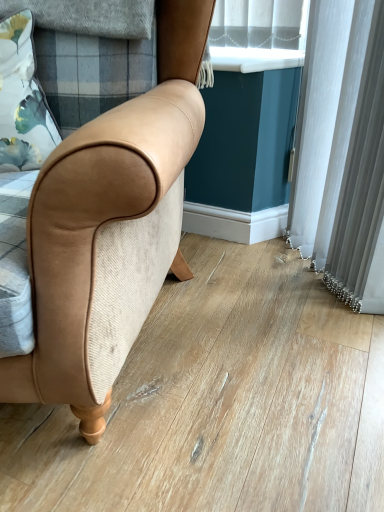
Locate an element on the screen. The image size is (384, 512). white plastic window sill at upper center is located at coordinates (254, 58).

The height and width of the screenshot is (512, 384). What are the coordinates of `floral fabric pillow at upper left` in the screenshot? It's located at (22, 99).

Considering the positions of objects floral fabric pillow at upper left and tan leather chair at center in the image provided, who is more to the left, floral fabric pillow at upper left or tan leather chair at center?

Positioned to the left is tan leather chair at center.

From the image's perspective, who appears lower, floral fabric pillow at upper left or tan leather chair at center?

tan leather chair at center is shown below in the image.

Is floral fabric pillow at upper left aimed at tan leather chair at center?

Yes.

From a real-world perspective, is floral fabric pillow at upper left located beneath tan leather chair at center?

Incorrect, from a real-world perspective, floral fabric pillow at upper left is higher than tan leather chair at center.

The width and height of the screenshot is (384, 512). In order to click on window sill that is behind the floral fabric pillow at upper left in this screenshot , I will do (x=254, y=58).

From the image's perspective, is floral fabric pillow at upper left on top of white plastic window sill at upper center?

No, from the image's perspective, floral fabric pillow at upper left is not above white plastic window sill at upper center.

Is floral fabric pillow at upper left bigger or smaller than white plastic window sill at upper center?

In the image, floral fabric pillow at upper left appears to be larger than white plastic window sill at upper center.

Is floral fabric pillow at upper left facing towards white plastic window sill at upper center?

No, floral fabric pillow at upper left does not turn towards white plastic window sill at upper center.

Does tan leather chair at center turn towards white plastic window sill at upper center?

No.

Based on the photo, is tan leather chair at center in contact with white plastic window sill at upper center?

tan leather chair at center is not next to white plastic window sill at upper center, and they're not touching.

Is tan leather chair at center further to the viewer compared to white plastic window sill at upper center?

No, it is not.

Can you confirm if tan leather chair at center is thinner than white plastic window sill at upper center?

No.

In the scene shown: Considering the relative sizes of tan leather chair at center and floral fabric pillow at upper left in the image provided, is tan leather chair at center thinner than floral fabric pillow at upper left?

No, tan leather chair at center is not thinner than floral fabric pillow at upper left.

Can you tell me how much tan leather chair at center and floral fabric pillow at upper left differ in facing direction?

tan leather chair at center and floral fabric pillow at upper left are facing 18.6 degrees away from each other.

From the image's perspective, which is above, tan leather chair at center or floral fabric pillow at upper left?

floral fabric pillow at upper left is shown above in the image.

Does tan leather chair at center touch floral fabric pillow at upper left?

There is a gap between tan leather chair at center and floral fabric pillow at upper left.

Does white plastic window sill at upper center have a lesser height compared to floral fabric pillow at upper left?

Correct, white plastic window sill at upper center is not as tall as floral fabric pillow at upper left.

Locate an element on the screen. pillow lying below the white plastic window sill at upper center (from the image's perspective) is located at coordinates (22, 99).

Does point (293, 57) come farther from viewer compared to point (22, 136)?

Yes, point (293, 57) is farther from viewer.

From a real-world perspective, is white plastic window sill at upper center physically located above or below floral fabric pillow at upper left?

white plastic window sill at upper center is situated higher than floral fabric pillow at upper left in the real world.

Is white plastic window sill at upper center spatially inside tan leather chair at center, or outside of it?

The correct answer is: outside.

From a real-world perspective, is white plastic window sill at upper center over tan leather chair at center?

Yes.

Between white plastic window sill at upper center and tan leather chair at center, which one has less height?

white plastic window sill at upper center.

At what (x,y) coordinates should I click in order to perform the action: click on chair below the floral fabric pillow at upper left (from a real-world perspective). Please return your answer as a coordinate pair (x, y). Image resolution: width=384 pixels, height=512 pixels. Looking at the image, I should click on (109, 228).

Image resolution: width=384 pixels, height=512 pixels. Identify the location of pillow on the left side of white plastic window sill at upper center. (22, 99).

Considering their positions, is tan leather chair at center positioned further to white plastic window sill at upper center than floral fabric pillow at upper left?

Based on the image, tan leather chair at center appears to be further to white plastic window sill at upper center.

Considering their positions, is white plastic window sill at upper center positioned further to tan leather chair at center than floral fabric pillow at upper left?

white plastic window sill at upper center.

When comparing their distances from tan leather chair at center, does floral fabric pillow at upper left or white plastic window sill at upper center seem further?

white plastic window sill at upper center.

Looking at the image, which one is located closer to white plastic window sill at upper center, floral fabric pillow at upper left or tan leather chair at center?

floral fabric pillow at upper left is closer to white plastic window sill at upper center.

When comparing their distances from floral fabric pillow at upper left, does white plastic window sill at upper center or tan leather chair at center seem further?

white plastic window sill at upper center.

In the scene shown: Looking at the image, which one is located further to floral fabric pillow at upper left, tan leather chair at center or white plastic window sill at upper center?

white plastic window sill at upper center is further to floral fabric pillow at upper left.

Where is `pillow located between tan leather chair at center and white plastic window sill at upper center in the depth direction`? pillow located between tan leather chair at center and white plastic window sill at upper center in the depth direction is located at coordinates [x=22, y=99].